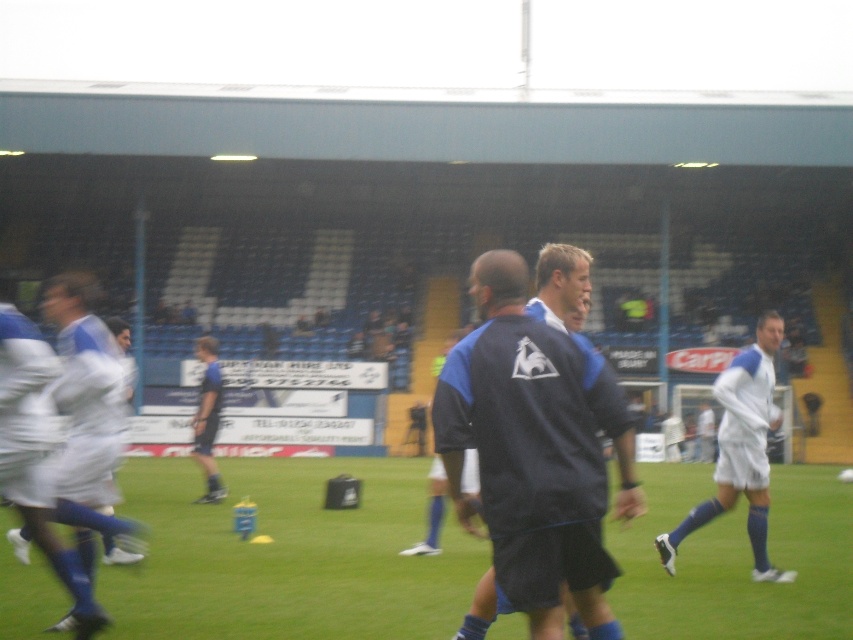
You are a soccer player who just kicked the ball. The ball is now rolling towards the green grass at center and the white fabric shorts at left. Which object will the ball hit first?

The ball will hit the green grass at center first because it is shorter than the white fabric shorts at left, so the ball would reach it sooner.

Based on the photo, you are a photographer standing at the center of the soccer field. You notice the white fabric shorts at left and the white smooth soccer player at right. Which object is higher in the image?

The white fabric shorts at left is located above the white smooth soccer player at right, so it is higher in the image.

You are a photographer positioned at the center of the field. You want to take a photo that includes both the white fabric shorts at left and the white smooth soccer player at right. Based on their positions, which object should be placed on the left side of the photo frame?

The white fabric shorts at left should be placed on the left side of the photo frame because they are positioned to the left of the white smooth soccer player at right.